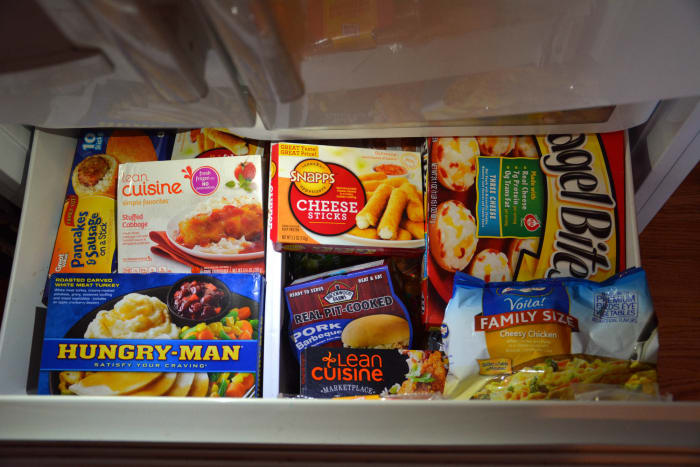
You are a GUI agent. You are given a task and a screenshot of the screen. Output one action in this format:
    pyautogui.click(x=<x>, y=<y>)
    Task: Click on the floor
    
    Given the screenshot: What is the action you would take?
    pyautogui.click(x=666, y=289)